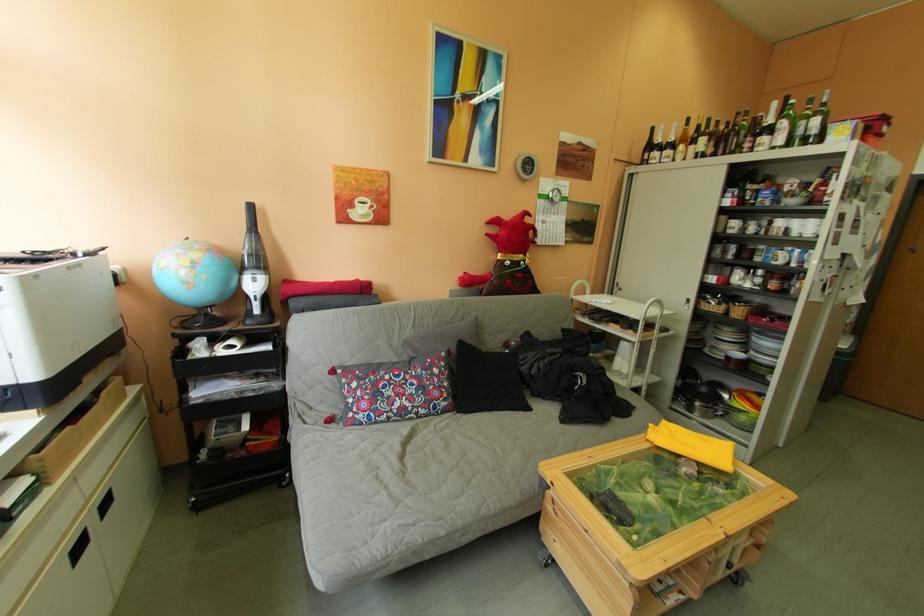
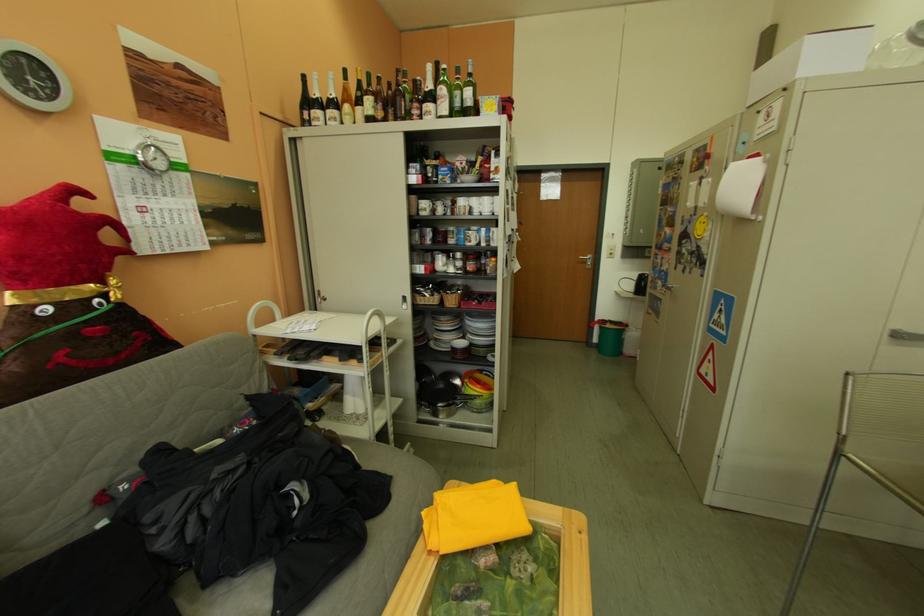
Locate, in the second image, the point that corresponds to [749,358] in the first image.

(473, 346)